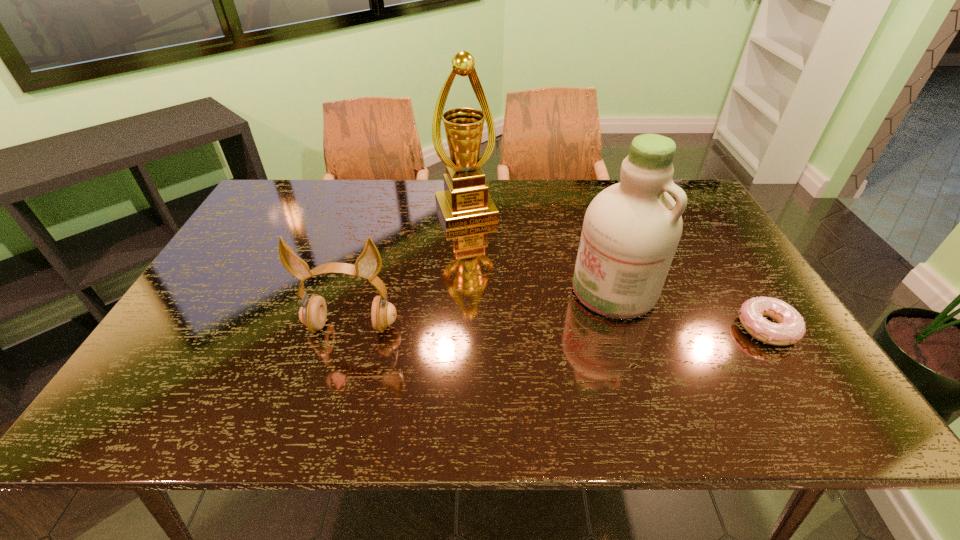
Where is `free spot on the desktop that is between the second shortest object and the shortest object and is positioned on the front-facing side of the farthest object`? free spot on the desktop that is between the second shortest object and the shortest object and is positioned on the front-facing side of the farthest object is located at coordinates (519, 327).

Where is `free space on the desktop that is between the second shortest object and the shortest object and is positioned on the front label of the third shortest object`? free space on the desktop that is between the second shortest object and the shortest object and is positioned on the front label of the third shortest object is located at coordinates (548, 327).